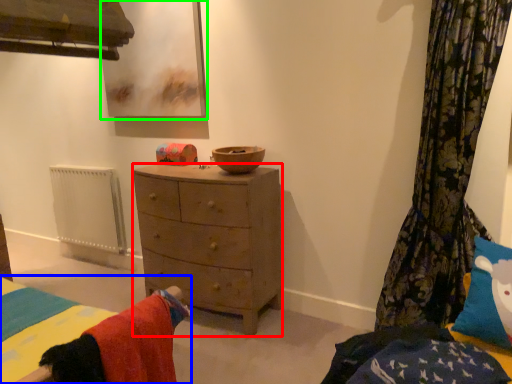
Question: Which object is the farthest from nightstand (highlighted by a red box)? Choose among these: bed (highlighted by a blue box) or picture frame (highlighted by a green box).

Choices:
 (A) bed
 (B) picture frame

Answer: (A)